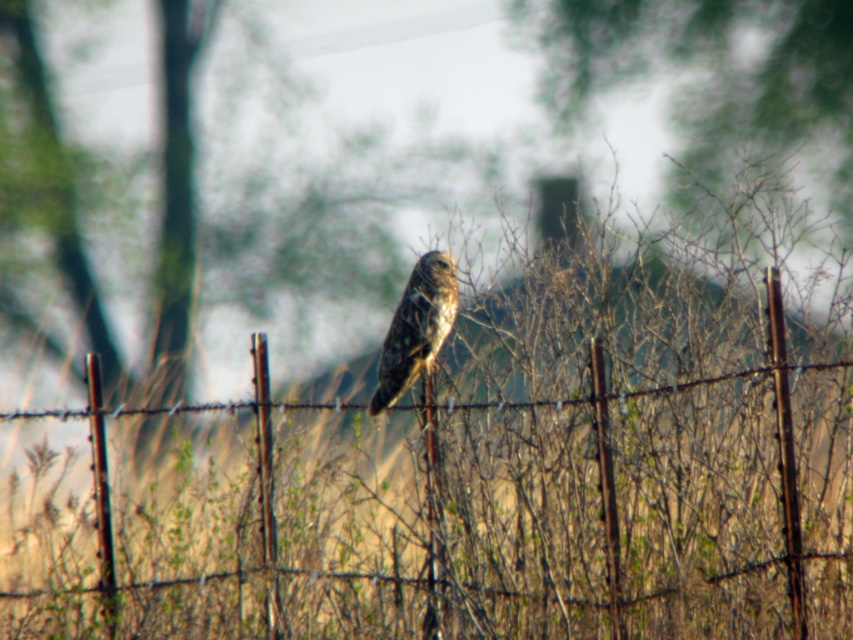
Between rusty wire fence at center and brown speckled owl at center, which one is positioned lower?

rusty wire fence at center is below.

Does point (595, 440) come behind point (444, 268)?

No, (595, 440) is closer to viewer.

Where is `rusty wire fence at center`? The image size is (853, 640). rusty wire fence at center is located at coordinates (503, 490).